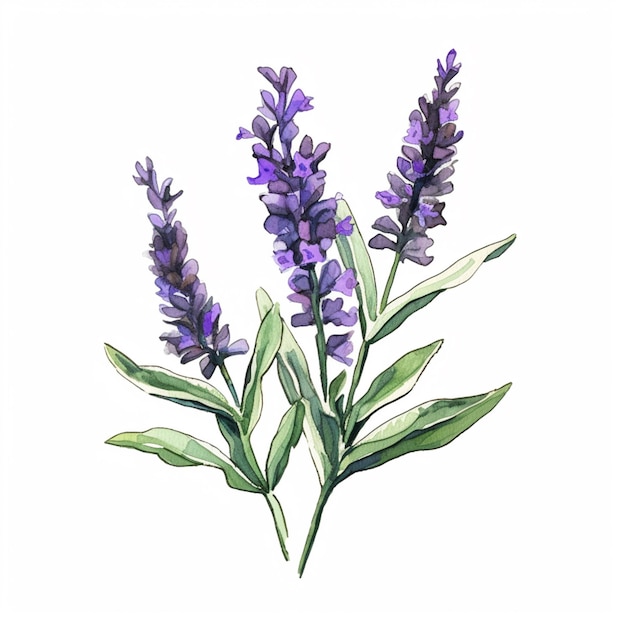
Locate an element on the screen. green plant stems is located at coordinates (277, 511), (315, 521), (321, 347), (225, 372), (354, 379), (391, 273).